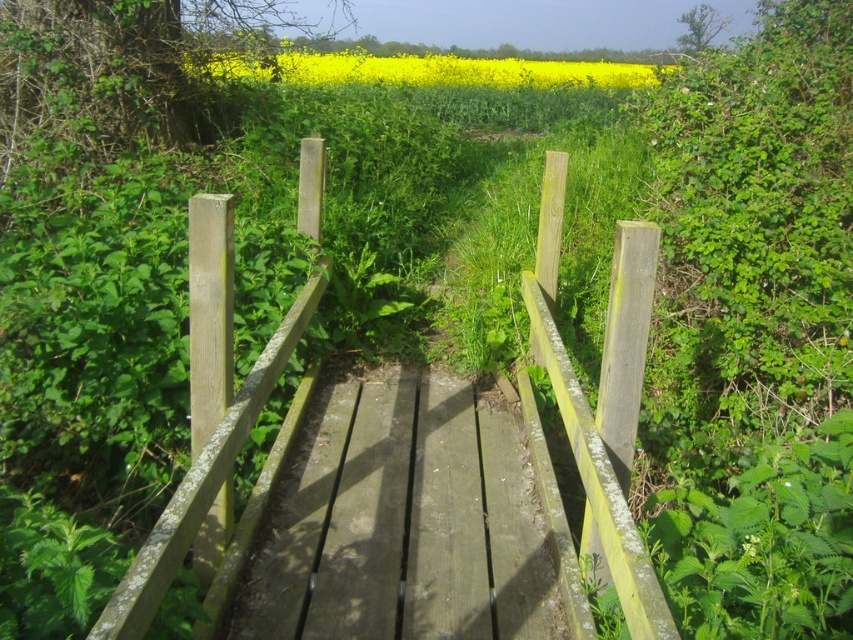
Who is positioned more to the right, smooth wooden path at center or yellow matte field at upper center?

Positioned to the right is smooth wooden path at center.

Between point (444, 552) and point (320, 81), which one is positioned behind?

The point (320, 81) is behind.

Where is `smooth wooden path at center`? smooth wooden path at center is located at coordinates pos(404,522).

Does weathered wood rail at center have a lesser width compared to smooth wooden path at center?

No.

Is point (210, 211) closer to camera compared to point (381, 616)?

Yes.

Where is `weathered wood rail at center`? The height and width of the screenshot is (640, 853). weathered wood rail at center is located at coordinates (398, 524).

Is weathered wood rail at center wider than yellow matte field at upper center?

Incorrect, weathered wood rail at center's width does not surpass yellow matte field at upper center's.

Does weathered wood rail at center appear on the right side of yellow matte field at upper center?

Correct, you'll find weathered wood rail at center to the right of yellow matte field at upper center.

Identify the location of weathered wood rail at center. The height and width of the screenshot is (640, 853). (398, 524).

The width and height of the screenshot is (853, 640). I want to click on weathered wood rail at center, so click(x=398, y=524).